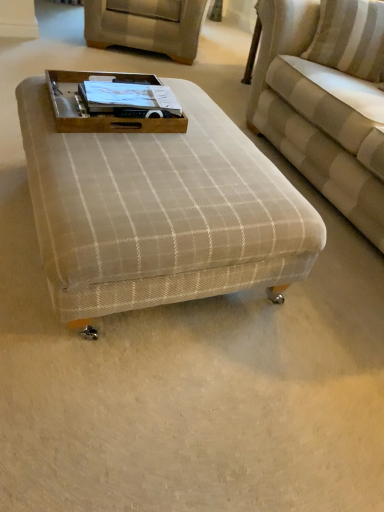
Image resolution: width=384 pixels, height=512 pixels. Identify the location of empty space that is ontop of beige plaid ottoman at center (from a real-world perspective). (164, 163).